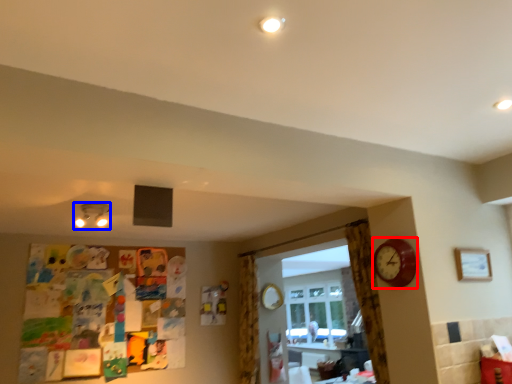
Question: Which object appears farthest to the camera in this image, clock (highlighted by a red box) or lamp (highlighted by a blue box)?

Choices:
 (A) clock
 (B) lamp

Answer: (B)